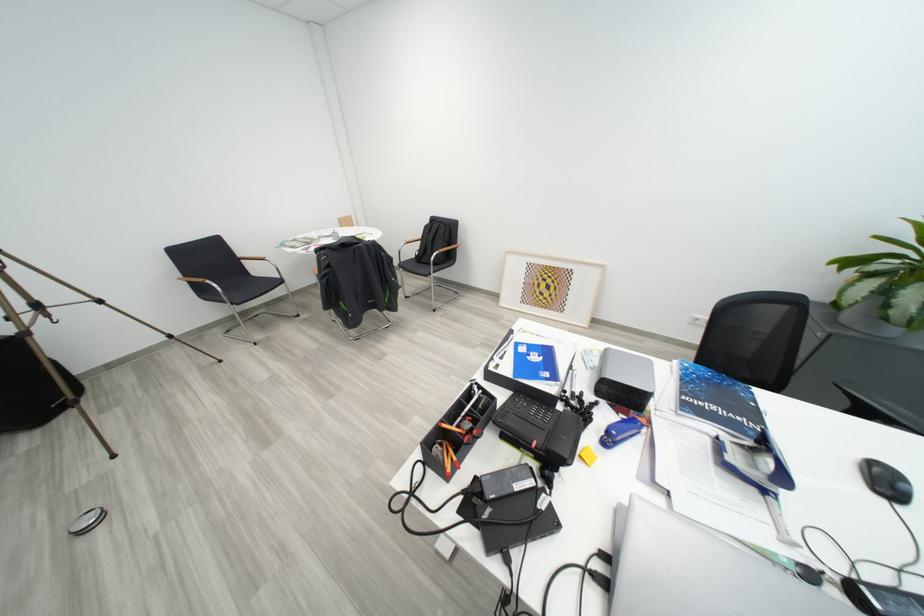
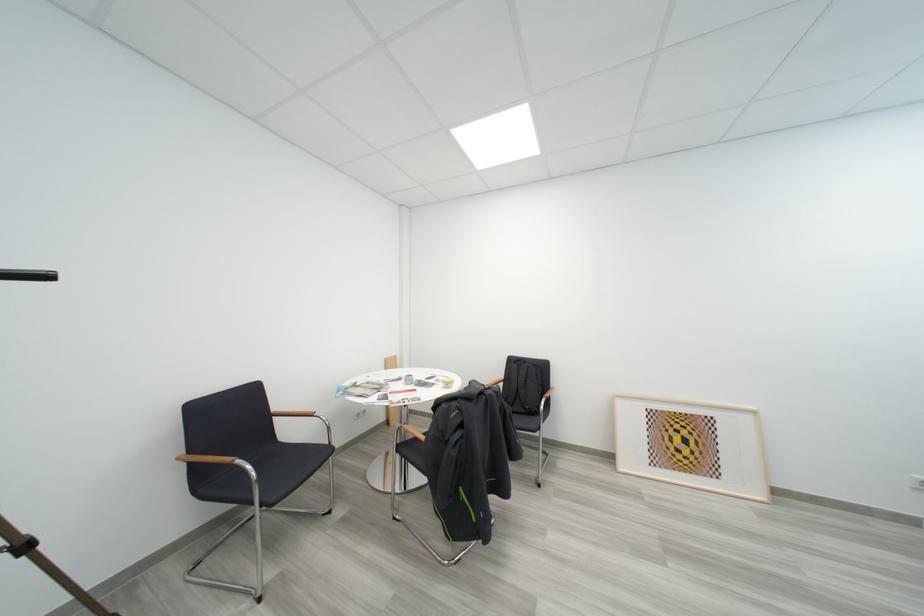
Locate, in the second image, the point that corresponds to [429,238] in the first image.

(512, 381)